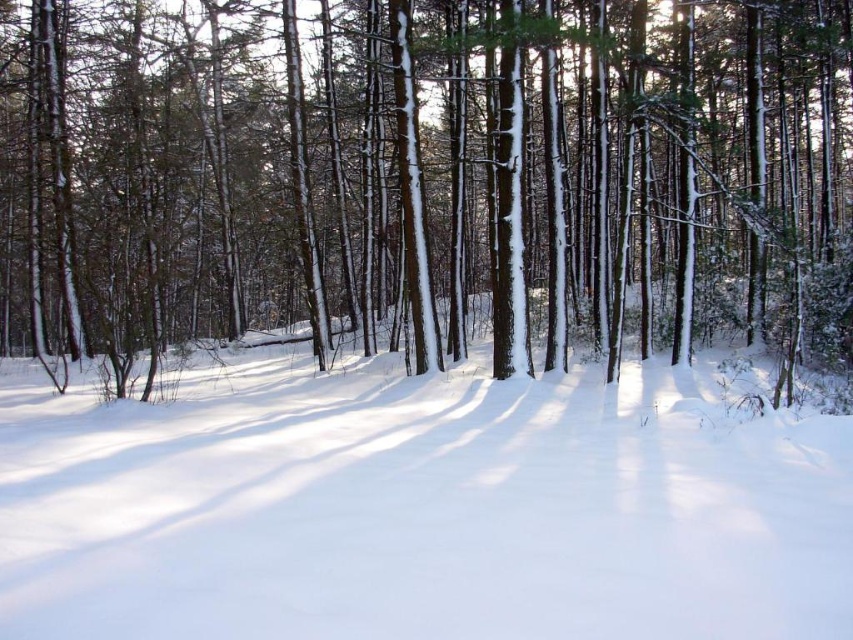
Which is above, smooth bark tree at center or white fluffy snow at center?

Positioned higher is smooth bark tree at center.

Is smooth bark tree at center behind white fluffy snow at center?

Yes, smooth bark tree at center is behind white fluffy snow at center.

Locate an element on the screen. The height and width of the screenshot is (640, 853). smooth bark tree at center is located at coordinates (426, 179).

Locate an element on the screen. smooth bark tree at center is located at coordinates (426, 179).